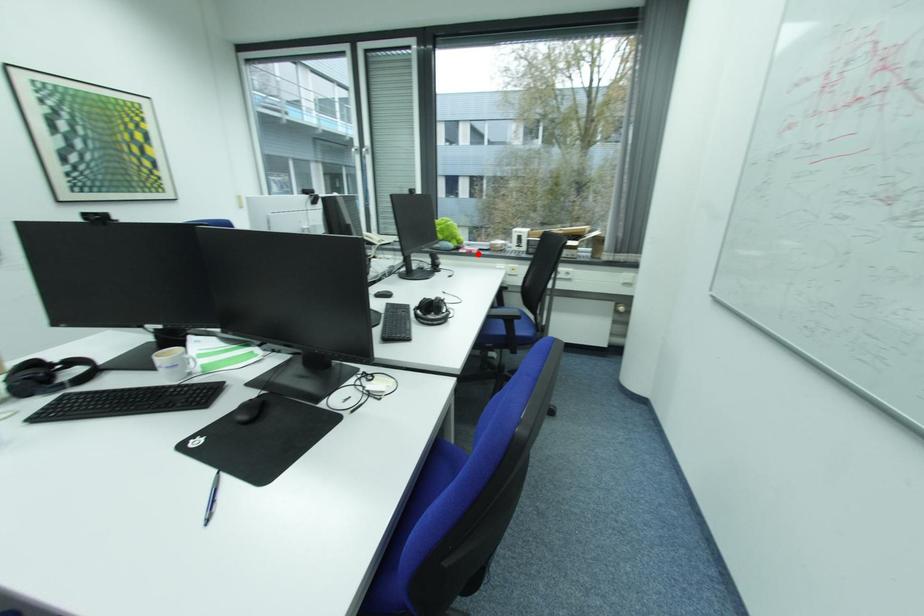
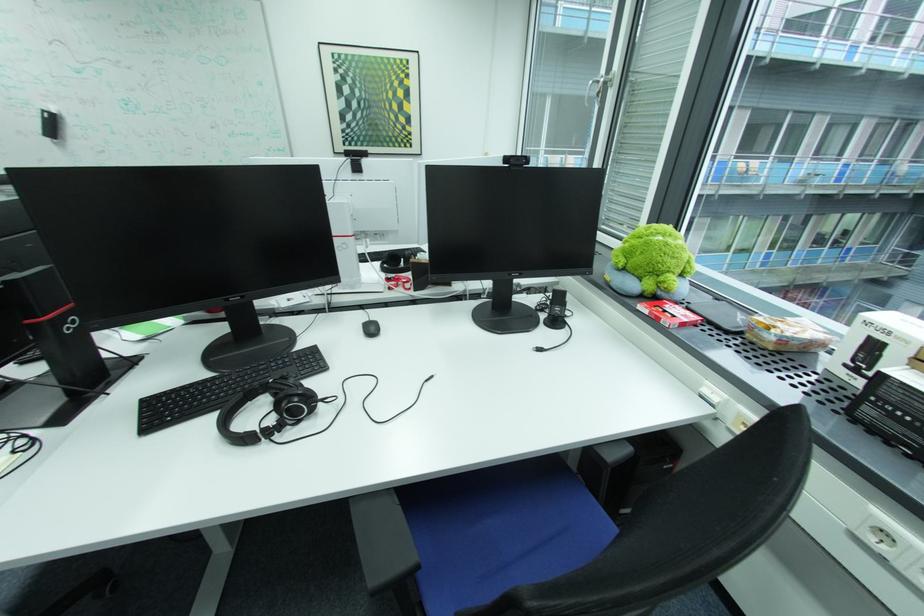
Question: I am providing you with two images of the same scene from different viewpoints. In image1, a red point is highlighted. Considering the same 3D point in image2, which of the following is correct?

Choices:
 (A) It is closer
 (B) It is farther

Answer: (A)